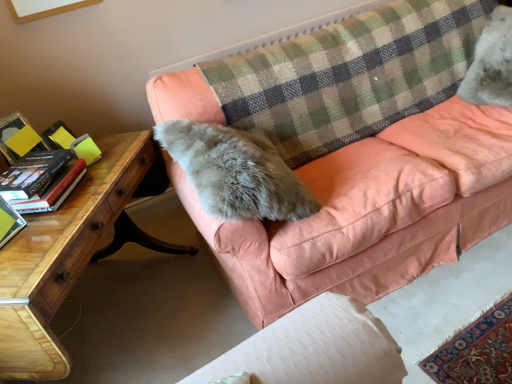
What do you see at coordinates (62, 257) in the screenshot? The width and height of the screenshot is (512, 384). I see `wooden desk at lower left` at bounding box center [62, 257].

What is the approximate width of wooden desk at lower left?

20.44 inches.

Describe the element at coordinates (53, 190) in the screenshot. The image size is (512, 384). I see `hardcover book at left, marked as the 2th paperback book in a front-to-back arrangement` at that location.

Measure the distance between point (449, 2) and camera.

The distance of point (449, 2) from camera is 6.95 feet.

The height and width of the screenshot is (384, 512). Identify the location of wooden desk at lower left. (62, 257).

Based on the photo, which object is further away from the camera, green matte book at left, which ranks as the 2th paperback book in back-to-front order, or white fluffy cat at upper right?

Positioned behind is white fluffy cat at upper right.

How different are the orientations of green matte book at left, positioned as the 1th paperback book in front-to-back order, and white fluffy cat at upper right in degrees?

They differ by 38.4 degrees in their facing directions.

Choose the correct answer: Is green matte book at left, positioned as the 1th paperback book in front-to-back order, inside white fluffy cat at upper right or outside it?

The correct answer is: outside.

From a real-world perspective, between checkered fabric plaid at upper center and hardcover book at left, marked as the 2th paperback book in a front-to-back arrangement, who is vertically lower?

checkered fabric plaid at upper center is physically lower.

Considering the positions of points (349, 87) and (48, 195), is point (349, 87) farther from camera compared to point (48, 195)?

Yes.

Which of these two, checkered fabric plaid at upper center or hardcover book at left, marked as the 2th paperback book in a front-to-back arrangement, stands shorter?

hardcover book at left, marked as the 2th paperback book in a front-to-back arrangement, is shorter.

I want to click on the 1st paperback book to the left when counting from the checkered fabric plaid at upper center, so [53, 190].

Which object is thinner, hardcover book at left, the first paperback book viewed from the back, or green matte book at left, positioned as the 1th paperback book in front-to-back order?

green matte book at left, positioned as the 1th paperback book in front-to-back order, is thinner.

From the image's perspective, is hardcover book at left, the first paperback book viewed from the back, located above or below green matte book at left, which ranks as the 2th paperback book in back-to-front order?

hardcover book at left, the first paperback book viewed from the back, is situated higher than green matte book at left, which ranks as the 2th paperback book in back-to-front order, in the image.

In terms of height, does hardcover book at left, the first paperback book viewed from the back, look taller or shorter compared to green matte book at left, which ranks as the 2th paperback book in back-to-front order?

In the image, hardcover book at left, the first paperback book viewed from the back, appears to be shorter than green matte book at left, which ranks as the 2th paperback book in back-to-front order.

Considering the relative sizes of hardcover book at left, marked as the 2th paperback book in a front-to-back arrangement, and wooden desk at lower left in the image provided, is hardcover book at left, marked as the 2th paperback book in a front-to-back arrangement, wider than wooden desk at lower left?

In fact, hardcover book at left, marked as the 2th paperback book in a front-to-back arrangement, might be narrower than wooden desk at lower left.

Does hardcover book at left, marked as the 2th paperback book in a front-to-back arrangement, have a smaller size compared to wooden desk at lower left?

Yes.

Considering the relative sizes of hardcover book at left, marked as the 2th paperback book in a front-to-back arrangement, and wooden desk at lower left in the image provided, is hardcover book at left, marked as the 2th paperback book in a front-to-back arrangement, taller than wooden desk at lower left?

In fact, hardcover book at left, marked as the 2th paperback book in a front-to-back arrangement, may be shorter than wooden desk at lower left.

Is checkered fabric plaid at upper center bigger than wooden desk at lower left?

Incorrect, checkered fabric plaid at upper center is not larger than wooden desk at lower left.

Between checkered fabric plaid at upper center and wooden desk at lower left, which one has smaller width?

checkered fabric plaid at upper center.

Is checkered fabric plaid at upper center oriented towards wooden desk at lower left?

No, checkered fabric plaid at upper center is not oriented towards wooden desk at lower left.

Measure the distance from checkered fabric plaid at upper center to wooden desk at lower left.

They are 90.90 centimeters apart.

Are peach velvet couch at center and white fluffy cat at upper right making contact?

No, peach velvet couch at center is not making contact with white fluffy cat at upper right.

Which object is positioned more to the left, peach velvet couch at center or white fluffy cat at upper right?

peach velvet couch at center.

From the image's perspective, which object appears higher, peach velvet couch at center or white fluffy cat at upper right?

white fluffy cat at upper right is shown above in the image.

From a real-world perspective, is checkered fabric plaid at upper center physically located above or below peach velvet couch at center?

In terms of real-world spatial position, checkered fabric plaid at upper center is above peach velvet couch at center.

Is checkered fabric plaid at upper center positioned beyond the bounds of peach velvet couch at center?

No.

Consider the image. How distant is checkered fabric plaid at upper center from peach velvet couch at center?

checkered fabric plaid at upper center is 36.63 centimeters away from peach velvet couch at center.

Which is more to the left, checkered fabric plaid at upper center or peach velvet couch at center?

checkered fabric plaid at upper center.

I want to click on paperback book that is the 2nd object located in front of the white fluffy cat at upper right, so click(x=9, y=222).

In order to click on the 1st paperback book located above the checkered fabric plaid at upper center (from a real-world perspective) in this screenshot , I will do `click(53, 190)`.

Considering their positions, is wooden desk at lower left positioned closer to green matte book at left, positioned as the 1th paperback book in front-to-back order, than white fluffy cat at upper right?

The object closer to green matte book at left, positioned as the 1th paperback book in front-to-back order, is wooden desk at lower left.

Based on the photo, looking at the image, which one is located further to checkered fabric plaid at upper center, green matte book at left, positioned as the 1th paperback book in front-to-back order, or peach velvet couch at center?

green matte book at left, positioned as the 1th paperback book in front-to-back order, is further to checkered fabric plaid at upper center.

Considering their positions, is hardcover book at left, marked as the 2th paperback book in a front-to-back arrangement, positioned further to white fluffy cat at upper right than wooden desk at lower left?

Among the two, hardcover book at left, marked as the 2th paperback book in a front-to-back arrangement, is located further to white fluffy cat at upper right.

Which object lies further to the anchor point wooden desk at lower left, white fluffy cat at upper right or hardcover book at left, the first paperback book viewed from the back?

white fluffy cat at upper right lies further to wooden desk at lower left than the other object.

Considering their positions, is checkered fabric plaid at upper center positioned further to peach velvet couch at center than hardcover book at left, marked as the 2th paperback book in a front-to-back arrangement?

hardcover book at left, marked as the 2th paperback book in a front-to-back arrangement, is positioned further to the anchor peach velvet couch at center.

Looking at this image, which object lies further to the anchor point white fluffy cat at upper right, wooden desk at lower left or hardcover book at left, the first paperback book viewed from the back?

The object further to white fluffy cat at upper right is hardcover book at left, the first paperback book viewed from the back.

In the scene shown: Estimate the real-world distances between objects in this image. Which object is closer to green matte book at left, which ranks as the 2th paperback book in back-to-front order, hardcover book at left, the first paperback book viewed from the back, or checkered fabric plaid at upper center?

Among the two, hardcover book at left, the first paperback book viewed from the back, is located nearer to green matte book at left, which ranks as the 2th paperback book in back-to-front order.

Consider the image. When comparing their distances from checkered fabric plaid at upper center, does peach velvet couch at center or wooden desk at lower left seem closer?

Among the two, peach velvet couch at center is located nearer to checkered fabric plaid at upper center.

The image size is (512, 384). Find the location of `desk between green matte book at left, positioned as the 1th paperback book in front-to-back order, and peach velvet couch at center, in the horizontal direction`. desk between green matte book at left, positioned as the 1th paperback book in front-to-back order, and peach velvet couch at center, in the horizontal direction is located at coordinates (62, 257).

At what (x,y) coordinates should I click in order to perform the action: click on studio couch between checkered fabric plaid at upper center and white fluffy cat at upper right from left to right. Please return your answer as a coordinate pair (x, y). The image size is (512, 384). Looking at the image, I should click on (372, 212).

At what (x,y) coordinates should I click in order to perform the action: click on studio couch between wooden desk at lower left and white fluffy cat at upper right. Please return your answer as a coordinate pair (x, y). The height and width of the screenshot is (384, 512). Looking at the image, I should click on (372, 212).

Where is `plaid situated between wooden desk at lower left and peach velvet couch at center from left to right`? The height and width of the screenshot is (384, 512). plaid situated between wooden desk at lower left and peach velvet couch at center from left to right is located at coordinates (350, 75).